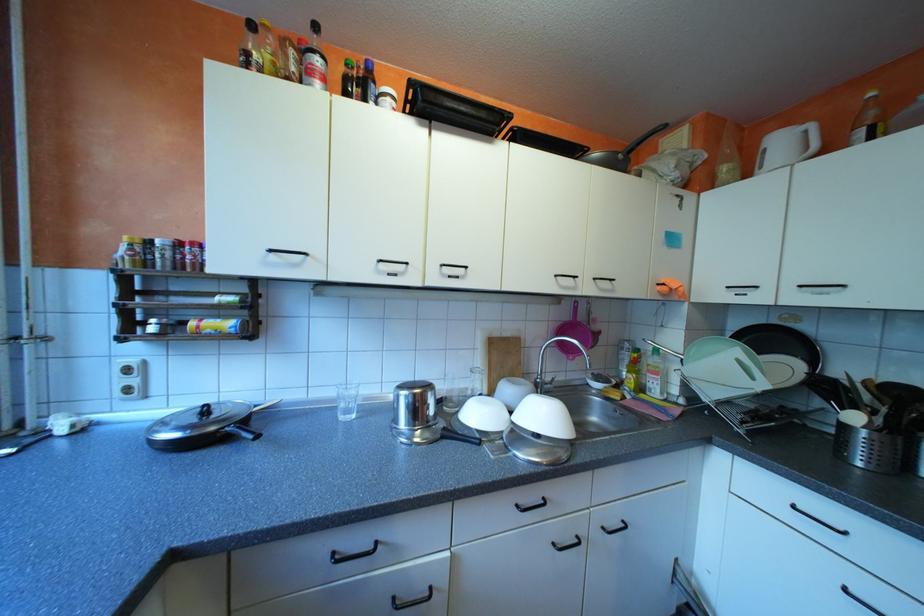
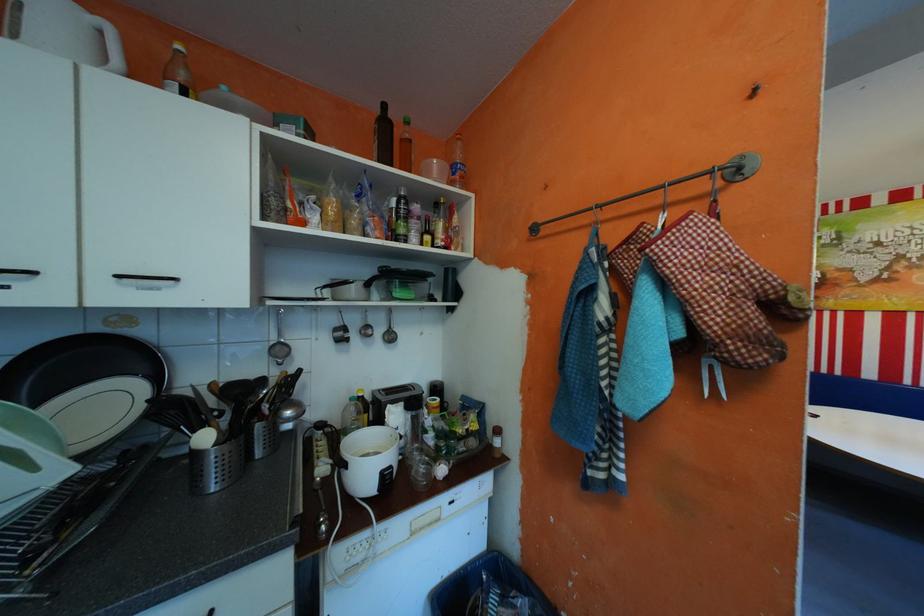
Locate, in the second image, the point that corresponds to [793,140] in the first image.

(66, 12)